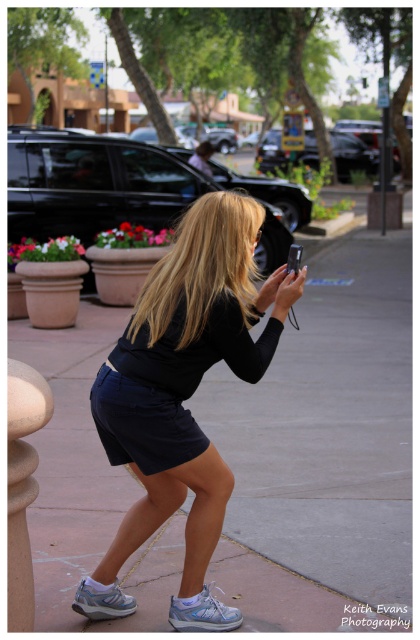
The width and height of the screenshot is (420, 640). In order to click on black cotton dress at center in this screenshot , I will do `click(170, 385)`.

Between point (173, 356) and point (199, 273), which one is positioned in front?

Point (173, 356)

Locate an element on the screen. black cotton dress at center is located at coordinates (170, 385).

Can you confirm if black matte shorts at center is positioned below blonde hair at center?

Yes.

I want to click on black matte shorts at center, so click(183, 396).

Can you confirm if black matte shorts at center is wider than matte black smartphone at center?

Indeed, black matte shorts at center has a greater width compared to matte black smartphone at center.

Is black matte shorts at center positioned in front of matte black smartphone at center?

Yes, black matte shorts at center is closer to the viewer.

Describe the element at coordinates (183, 396) in the screenshot. I see `black matte shorts at center` at that location.

The image size is (420, 640). Find the location of `black matte shorts at center`. black matte shorts at center is located at coordinates pyautogui.click(x=183, y=396).